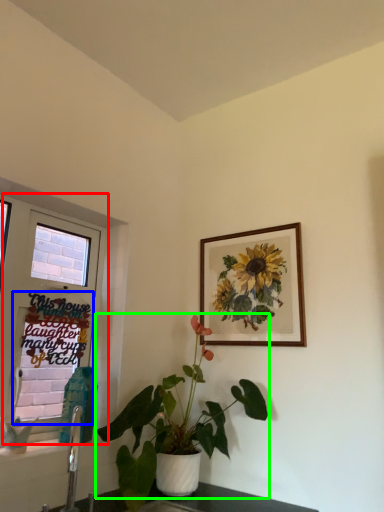
Question: Based on their relative distances, which object is farther from window (highlighted by a red box)? Choose from window screen (highlighted by a blue box) and houseplant (highlighted by a green box).

Choices:
 (A) window screen
 (B) houseplant

Answer: (A)